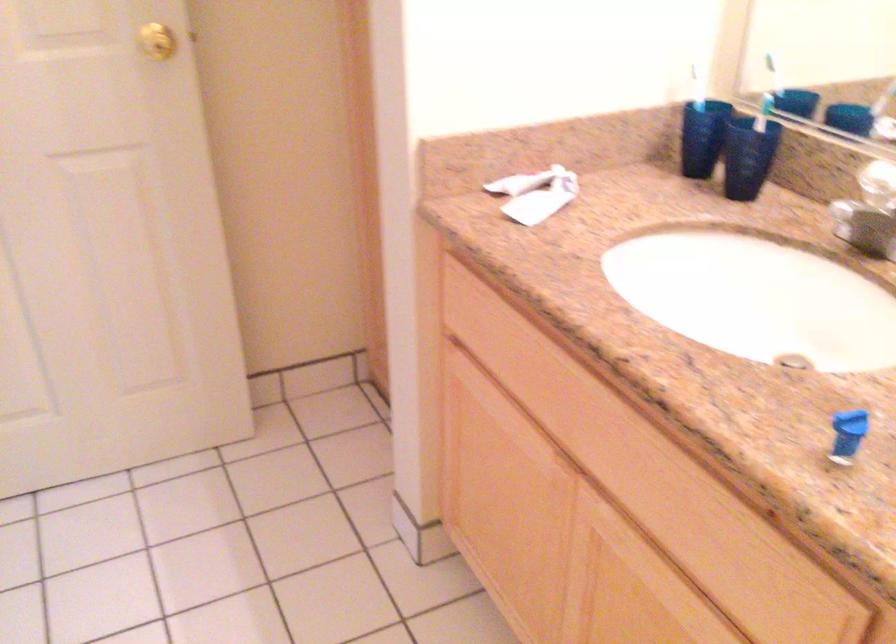
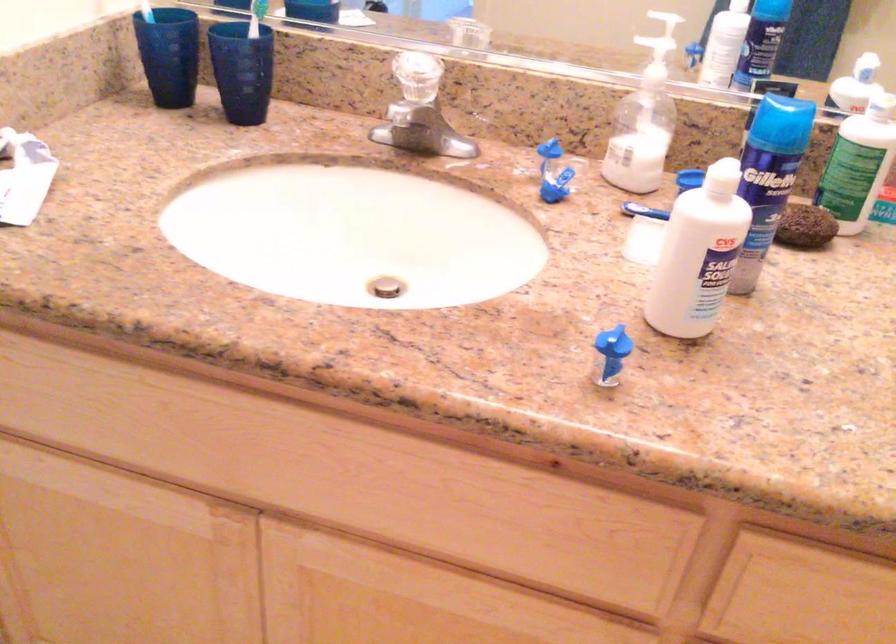
Question: I am providing you with two images of the same scene from different viewpoints. After the viewpoint changes to image2, which objects are now occluded?

Choices:
 (A) blue flip cap
 (B) dark blue cup
 (C) green label bottle
 (D) none of these

Answer: (D)